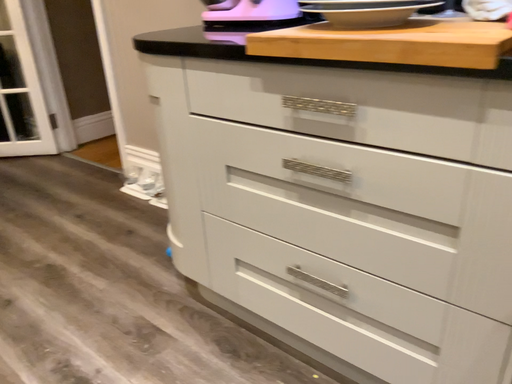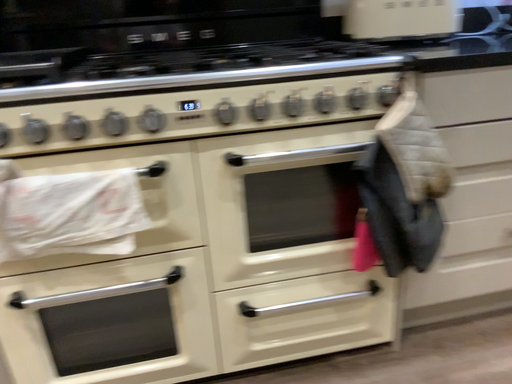
Question: How did the camera likely rotate when shooting the video?

Choices:
 (A) rotated downward
 (B) rotated upward

Answer: (B)